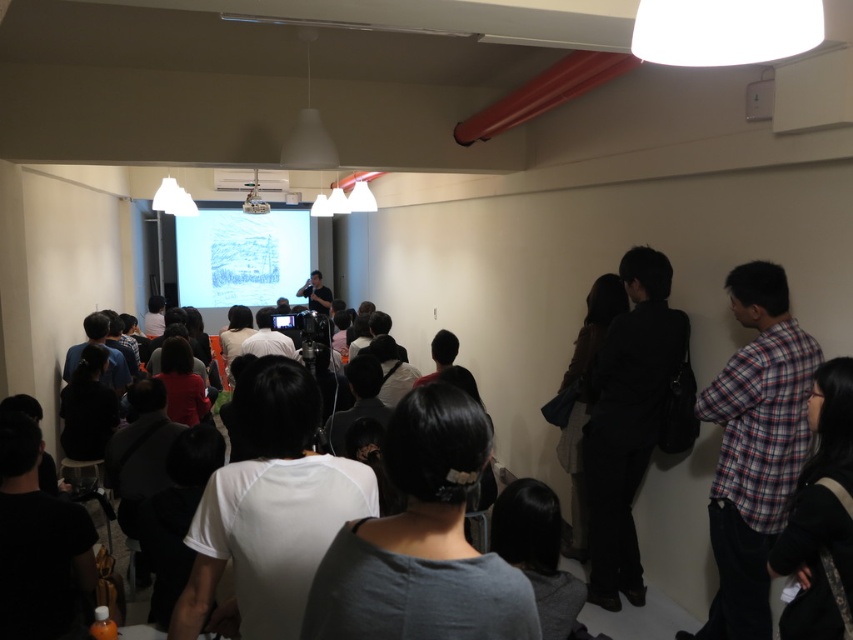
Does point (722, 509) lie behind point (635, 368)?

No.

Which is behind, point (793, 406) or point (589, 504)?

The point (589, 504) is behind.

Find the location of a particular element. plaid fabric shirt at right is located at coordinates (753, 448).